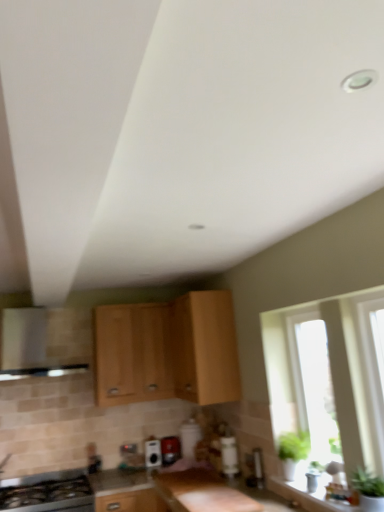
Question: Does transparent glass window at right appear on the right side of black glass stove at lower left?

Choices:
 (A) no
 (B) yes

Answer: (B)

Question: Is transparent glass window at right far away from black glass stove at lower left?

Choices:
 (A) yes
 (B) no

Answer: (A)

Question: From the image's perspective, would you say transparent glass window at right is positioned over black glass stove at lower left?

Choices:
 (A) no
 (B) yes

Answer: (B)

Question: Does transparent glass window at right have a lesser height compared to black glass stove at lower left?

Choices:
 (A) no
 (B) yes

Answer: (A)

Question: Does transparent glass window at right have a larger size compared to black glass stove at lower left?

Choices:
 (A) no
 (B) yes

Answer: (A)

Question: From a real-world perspective, is transparent glass window at right physically above black glass stove at lower left?

Choices:
 (A) no
 (B) yes

Answer: (B)

Question: Is light wood cabinet at center, which is the third cabinetry from left to right, positioned far away from smooth granite countertop at center?

Choices:
 (A) no
 (B) yes

Answer: (A)

Question: Is light wood cabinet at center, marked as the first cabinetry in a right-to-left arrangement, next to smooth granite countertop at center and touching it?

Choices:
 (A) yes
 (B) no

Answer: (B)

Question: From the image's perspective, would you say light wood cabinet at center, which is the third cabinetry from left to right, is shown under smooth granite countertop at center?

Choices:
 (A) yes
 (B) no

Answer: (B)

Question: From the image's perspective, does light wood cabinet at center, which is the third cabinetry from left to right, appear higher than smooth granite countertop at center?

Choices:
 (A) yes
 (B) no

Answer: (A)

Question: Is light wood cabinet at center, marked as the first cabinetry in a right-to-left arrangement, thinner than smooth granite countertop at center?

Choices:
 (A) no
 (B) yes

Answer: (A)

Question: Is light wood cabinet at center, marked as the first cabinetry in a right-to-left arrangement, at the left side of smooth granite countertop at center?

Choices:
 (A) yes
 (B) no

Answer: (B)

Question: Is light wood cabinet at center, which is the third cabinetry from left to right, smaller than transparent glass window at right?

Choices:
 (A) yes
 (B) no

Answer: (B)